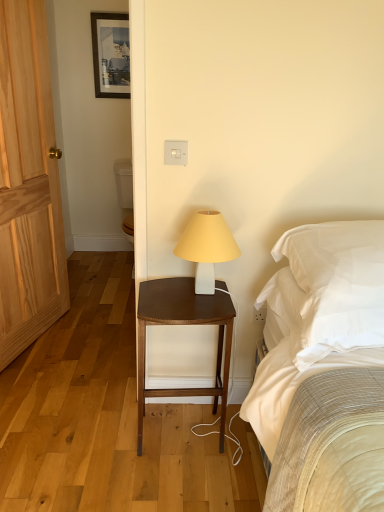
Question: Does light wood door at left lie in front of matte black picture frame at upper center?

Choices:
 (A) no
 (B) yes

Answer: (B)

Question: From the image's perspective, is light wood door at left on top of matte black picture frame at upper center?

Choices:
 (A) yes
 (B) no

Answer: (B)

Question: Can you confirm if light wood door at left is positioned to the left of matte black picture frame at upper center?

Choices:
 (A) yes
 (B) no

Answer: (A)

Question: Is light wood door at left far from matte black picture frame at upper center?

Choices:
 (A) yes
 (B) no

Answer: (A)

Question: Is light wood door at left wider than matte black picture frame at upper center?

Choices:
 (A) no
 (B) yes

Answer: (B)

Question: From the image's perspective, is light wood door at left located beneath matte black picture frame at upper center?

Choices:
 (A) no
 (B) yes

Answer: (B)

Question: Does brown wood nightstand at center lie in front of matte black picture frame at upper center?

Choices:
 (A) no
 (B) yes

Answer: (B)

Question: Does brown wood nightstand at center have a lesser width compared to matte black picture frame at upper center?

Choices:
 (A) no
 (B) yes

Answer: (A)

Question: From the image's perspective, is brown wood nightstand at center located above matte black picture frame at upper center?

Choices:
 (A) yes
 (B) no

Answer: (B)

Question: Considering the relative sizes of brown wood nightstand at center and matte black picture frame at upper center in the image provided, is brown wood nightstand at center taller than matte black picture frame at upper center?

Choices:
 (A) no
 (B) yes

Answer: (B)

Question: From the image's perspective, is brown wood nightstand at center located beneath matte black picture frame at upper center?

Choices:
 (A) yes
 (B) no

Answer: (A)

Question: From a real-world perspective, is brown wood nightstand at center positioned under matte black picture frame at upper center based on gravity?

Choices:
 (A) yes
 (B) no

Answer: (A)

Question: Does white soft pillow at right come behind brown wood nightstand at center?

Choices:
 (A) no
 (B) yes

Answer: (A)